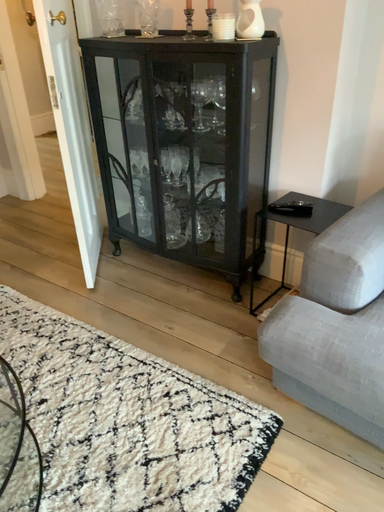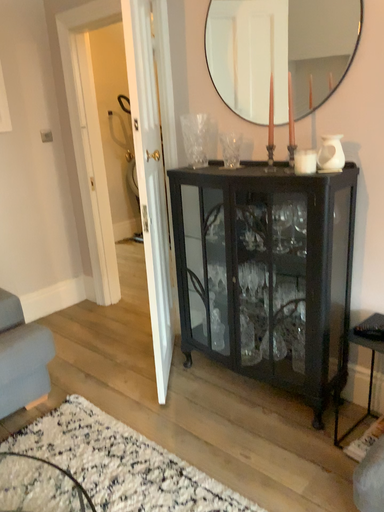
Question: Which way did the camera rotate in the video?

Choices:
 (A) rotated downward
 (B) rotated upward

Answer: (B)